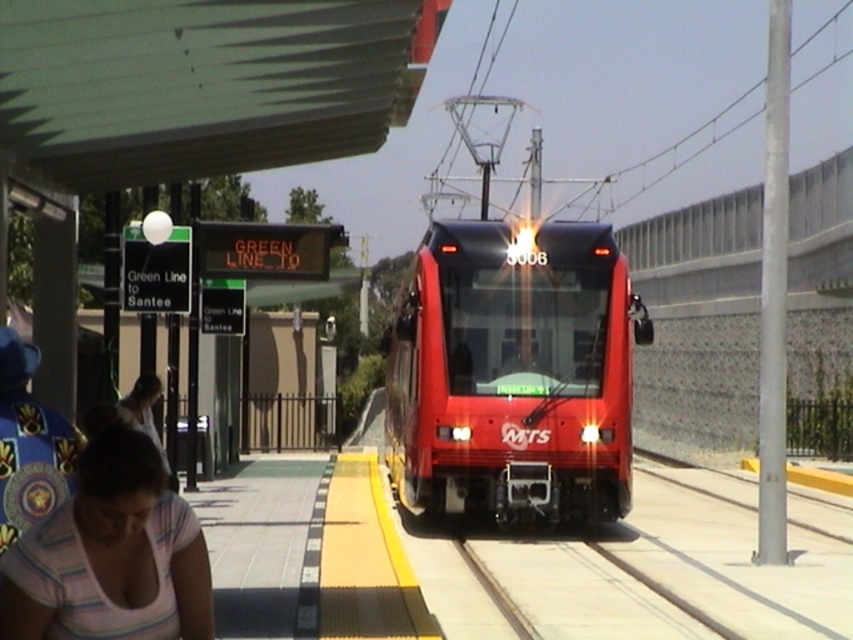
Which is in front, point (556, 300) or point (62, 588)?

Positioned in front is point (62, 588).

Is shiny red train at center below pink striped shirt at lower left?

Correct, shiny red train at center is located below pink striped shirt at lower left.

Where is `shiny red train at center`? This screenshot has width=853, height=640. shiny red train at center is located at coordinates (514, 374).

Who is lower down, shiny red train at center or metal train track at center?

Positioned lower is metal train track at center.

Does point (556, 241) come behind point (521, 609)?

Yes, point (556, 241) is behind point (521, 609).

The image size is (853, 640). I want to click on shiny red train at center, so click(x=514, y=374).

How much distance is there between pink striped shirt at lower left and metal train track at center?

pink striped shirt at lower left is 27.36 feet from metal train track at center.

Between pink striped shirt at lower left and metal train track at center, which one has more height?

pink striped shirt at lower left is taller.

Where is `pink striped shirt at lower left`? The height and width of the screenshot is (640, 853). pink striped shirt at lower left is located at coordinates (109, 556).

Locate an element on the screen. pink striped shirt at lower left is located at coordinates (109, 556).